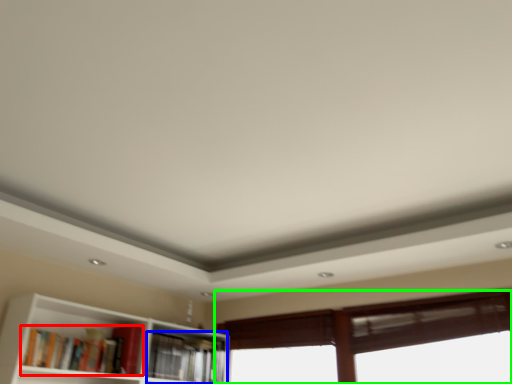
Question: Based on their relative distances, which object is farther from book (highlighted by a red box)? Choose from book (highlighted by a blue box) and window (highlighted by a green box).

Choices:
 (A) book
 (B) window

Answer: (B)